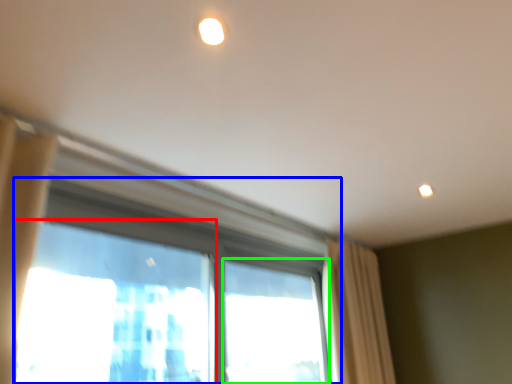
Question: Which object is the closest to the window screen (highlighted by a red box)? Choose among these: window (highlighted by a blue box) or window (highlighted by a green box).

Choices:
 (A) window
 (B) window

Answer: (B)